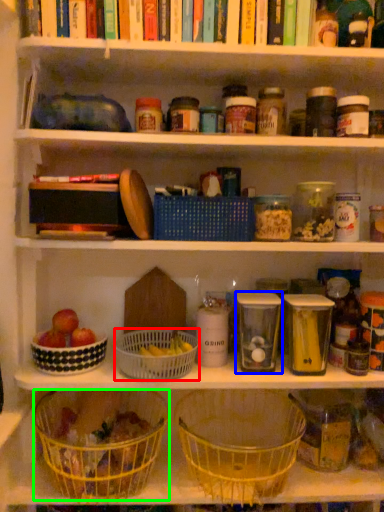
Question: Which object is positioned farthest from basket (highlighted by a red box)? Select from glass jar (highlighted by a blue box) and basket (highlighted by a green box).

Choices:
 (A) glass jar
 (B) basket

Answer: (A)